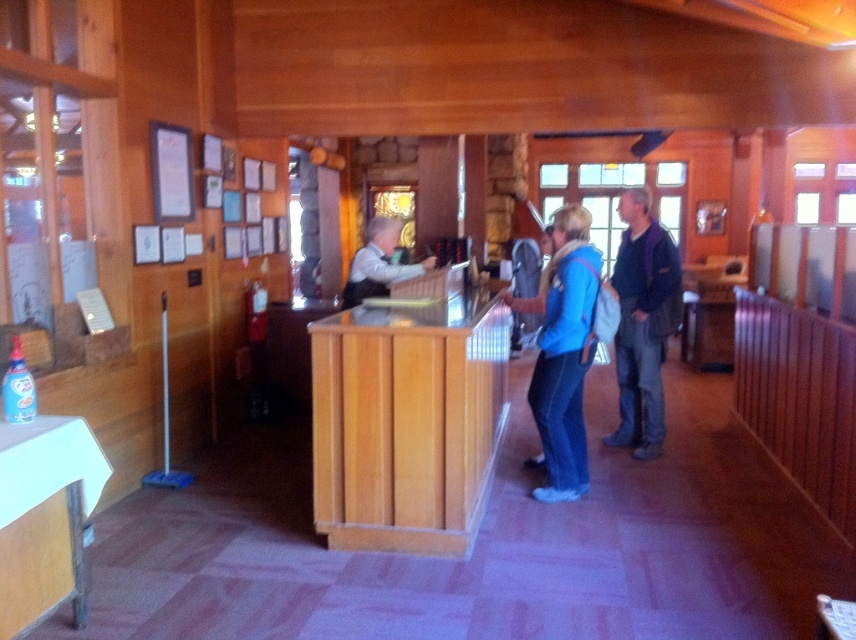
Question: Can you confirm if blue fabric backpack at center is wider than matte black vest at center?

Choices:
 (A) yes
 (B) no

Answer: (B)

Question: Is blue fabric backpack at center below matte black vest at center?

Choices:
 (A) yes
 (B) no

Answer: (A)

Question: Is the position of wooden counter at center less distant than that of matte black vest at center?

Choices:
 (A) no
 (B) yes

Answer: (B)

Question: Considering the real-world distances, which object is closest to the matte black vest at center?

Choices:
 (A) blue fabric backpack at center
 (B) dark blue sweater at center

Answer: (A)

Question: Estimate the real-world distances between objects in this image. Which object is farther from the dark blue sweater at center?

Choices:
 (A) matte black vest at center
 (B) blue fabric backpack at center

Answer: (A)

Question: Which of the following is the farthest from the observer?

Choices:
 (A) (354, 300)
 (B) (616, 376)
 (C) (575, 369)

Answer: (B)